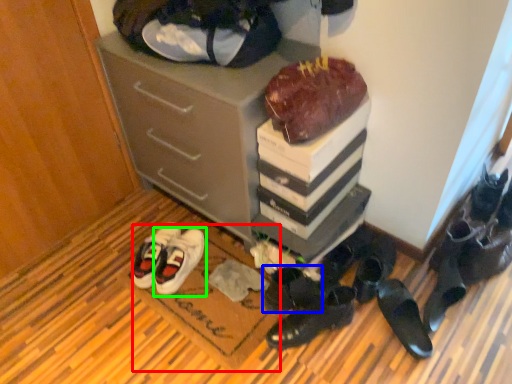
Question: Which object is the closest to the doormat (highlighted by a red box)? Choose among these: footwear (highlighted by a blue box) or footwear (highlighted by a green box).

Choices:
 (A) footwear
 (B) footwear

Answer: (B)